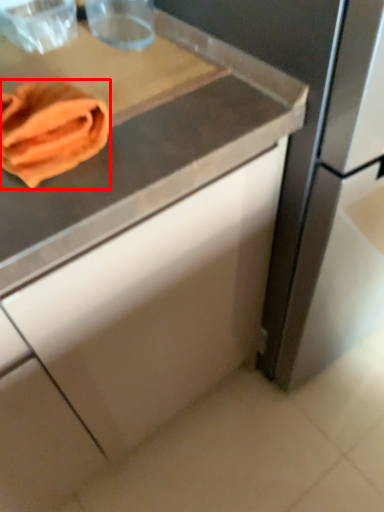
Question: From the image's perspective, where is material (annotated by the red box) located in relation to cutting board in the image?

Choices:
 (A) below
 (B) above

Answer: (A)